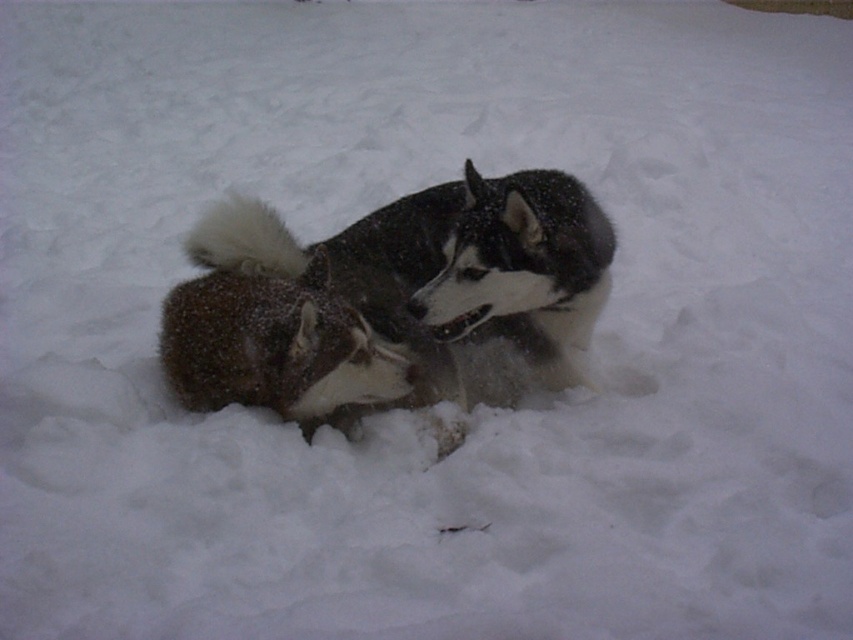
Question: Which point is closer to the camera?

Choices:
 (A) black and white fur dog at center
 (B) fuzzy fur dog at center

Answer: (A)

Question: Is black and white fur dog at center thinner than fuzzy fur dog at center?

Choices:
 (A) no
 (B) yes

Answer: (A)

Question: Can you confirm if black and white fur dog at center is positioned below fuzzy fur dog at center?

Choices:
 (A) yes
 (B) no

Answer: (B)

Question: Is black and white fur dog at center smaller than fuzzy fur dog at center?

Choices:
 (A) no
 (B) yes

Answer: (A)

Question: Which point is farther from the camera taking this photo?

Choices:
 (A) 401,220
 (B) 263,312

Answer: (A)